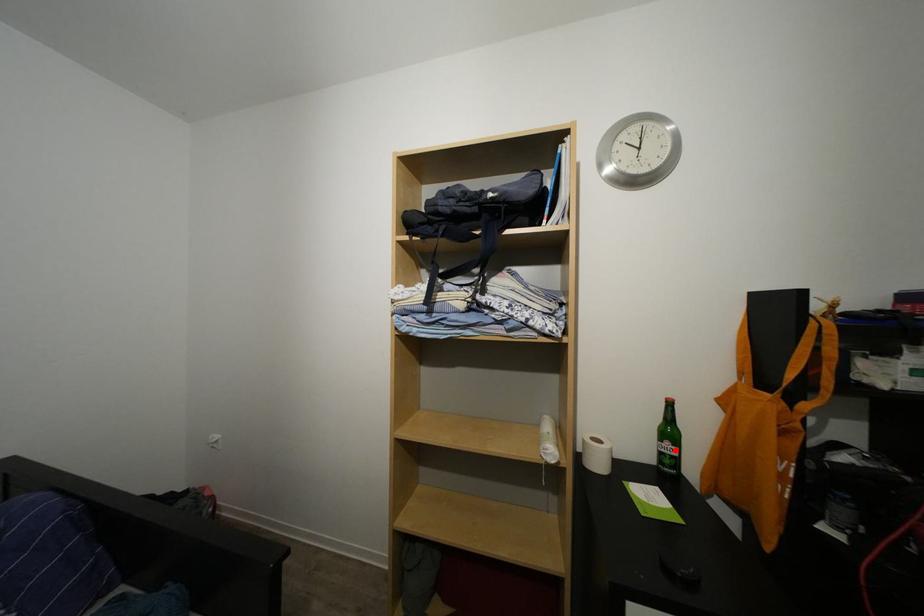
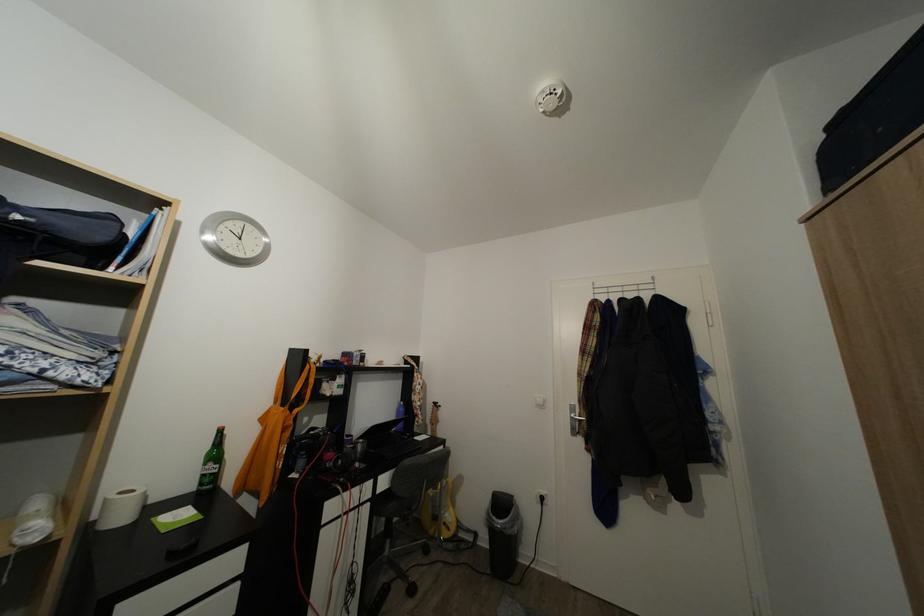
Where in the second image is the point corresponding to the highlighted location from the first image?

(217, 471)